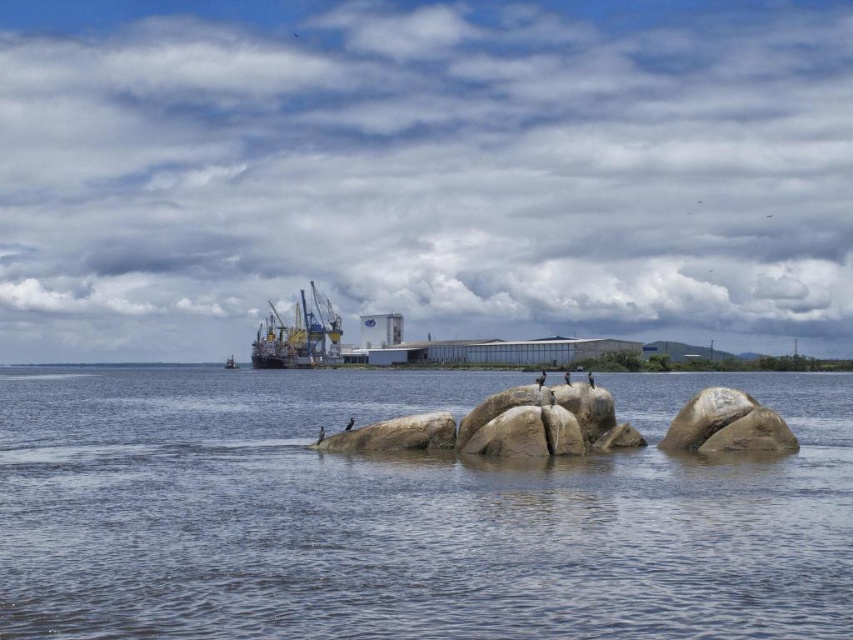
Does clear water at center have a smaller size compared to metallic gray boat at center?

No.

Is point (219, 554) positioned in front of point (230, 356)?

Yes, it is.

This screenshot has width=853, height=640. In order to click on clear water at center in this screenshot , I will do `click(404, 515)`.

Is metallic gray ship at center thinner than metallic gray boat at center?

No, metallic gray ship at center is not thinner than metallic gray boat at center.

Is point (273, 348) in front of point (231, 360)?

Yes, it is.

Where is `metallic gray ship at center`? metallic gray ship at center is located at coordinates (299, 336).

Is clear water at center closer to the viewer compared to metallic gray ship at center?

Yes, clear water at center is closer to the viewer.

Does clear water at center appear on the right side of metallic gray ship at center?

Indeed, clear water at center is positioned on the right side of metallic gray ship at center.

Which is in front, point (276, 480) or point (311, 310)?

Point (276, 480) is more forward.

I want to click on clear water at center, so coord(404,515).